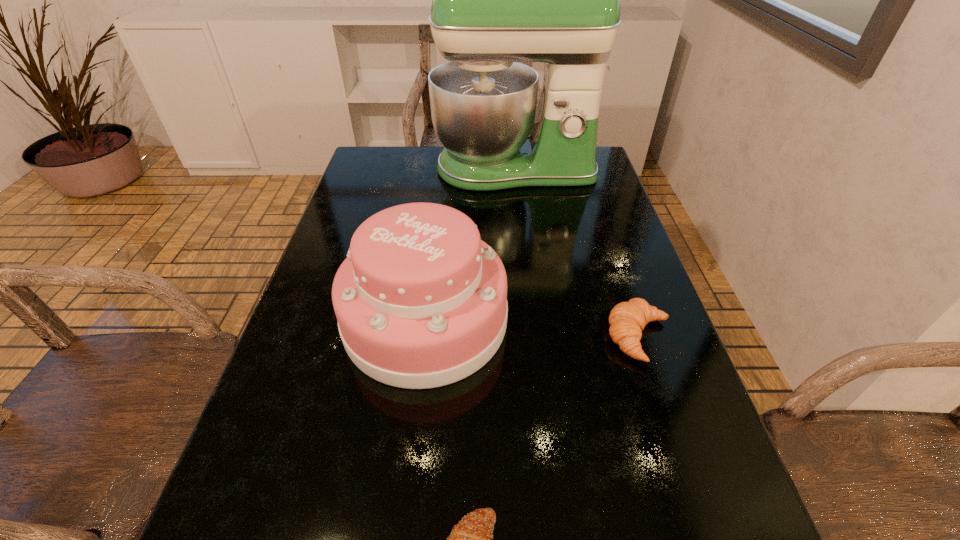
Where is `free space that satisfies the following two spatial constraints: 1. on the front side of the taller crescent roll; 2. on the left side of the second tallest object`? free space that satisfies the following two spatial constraints: 1. on the front side of the taller crescent roll; 2. on the left side of the second tallest object is located at coordinates (423, 337).

Where is `vacant space that satisfies the following two spatial constraints: 1. on the controls of the third tallest object; 2. on the right side of the farthest object`? The width and height of the screenshot is (960, 540). vacant space that satisfies the following two spatial constraints: 1. on the controls of the third tallest object; 2. on the right side of the farthest object is located at coordinates (534, 337).